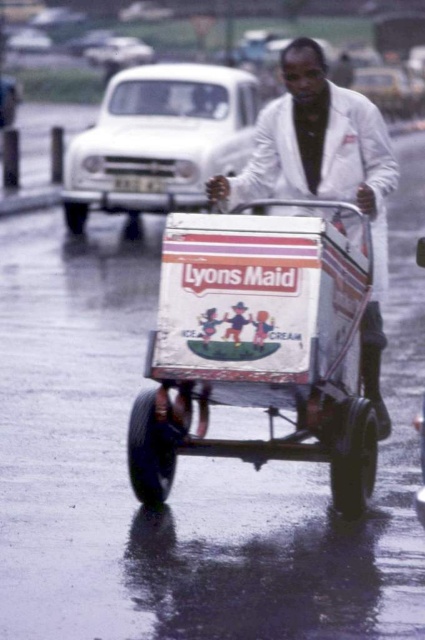
You are a child standing in front of the metallic ice cream wagon at center and the white matte jacket at center. Which object is taller?

The metallic ice cream wagon at center is much taller than the white matte jacket at center.

You are a customer standing at the front of the metallic ice cream wagon at center. You want to hand over money to the vendor wearing the white matte jacket at center. Can you reach him without moving from your current position? The average arm length of an adult is 0.7 meters.

The distance between the metallic ice cream wagon at center and the white matte jacket at center is 1.40 meters. Since the average adult arm length is 0.7 meters, the vendor would need to step forward to reach you as the distance exceeds the combined arm lengths of both parties.

You are standing at the center of the street and see the point marked at coordinate (257,348). What object is located at that point?

The point at coordinate (257,348) indicates the metallic ice cream wagon at center.